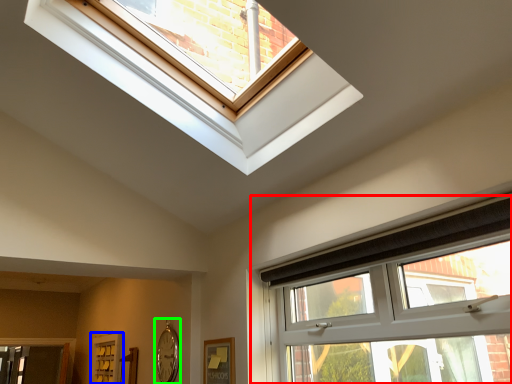
Question: Which object is positioned closest to window (highlighted by a red box)? Select from screen door (highlighted by a blue box) and clock (highlighted by a green box).

Choices:
 (A) screen door
 (B) clock

Answer: (B)